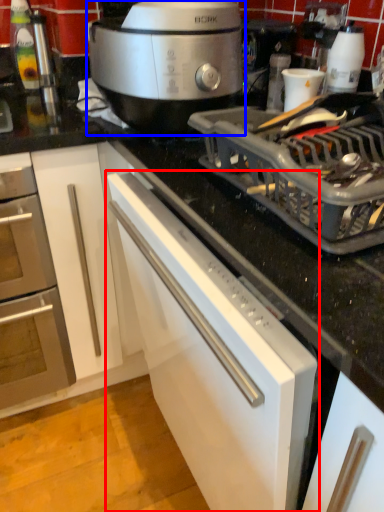
Question: Which point is closer to the camera, cabinetry (highlighted by a red box) or slow cooker (highlighted by a blue box)?

Choices:
 (A) cabinetry
 (B) slow cooker

Answer: (A)